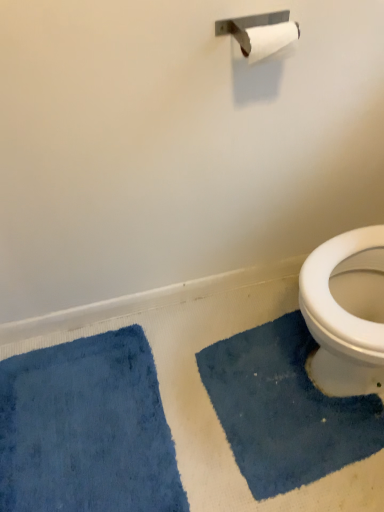
Question: Should I look upward or downward to see blue plush bath mat at lower left, placed as the 1th bath mat when sorted from left to right?

Choices:
 (A) down
 (B) up

Answer: (A)

Question: Does blue plush bath mat at lower right, arranged as the first bath mat when viewed from the right, have a lesser width compared to blue plush bath mat at lower left, placed as the 1th bath mat when sorted from left to right?

Choices:
 (A) no
 (B) yes

Answer: (B)

Question: Does blue plush bath mat at lower right, arranged as the first bath mat when viewed from the right, contain blue plush bath mat at lower left, which appears as the 2th bath mat when viewed from the right?

Choices:
 (A) yes
 (B) no

Answer: (B)

Question: Is blue plush bath mat at lower right, the second bath mat from the left, bigger than blue plush bath mat at lower left, which appears as the 2th bath mat when viewed from the right?

Choices:
 (A) no
 (B) yes

Answer: (A)

Question: Considering the relative positions of blue plush bath mat at lower right, arranged as the first bath mat when viewed from the right, and blue plush bath mat at lower left, which appears as the 2th bath mat when viewed from the right, in the image provided, is blue plush bath mat at lower right, arranged as the first bath mat when viewed from the right, to the right of blue plush bath mat at lower left, which appears as the 2th bath mat when viewed from the right, from the viewer's perspective?

Choices:
 (A) no
 (B) yes

Answer: (B)

Question: Is blue plush bath mat at lower right, arranged as the first bath mat when viewed from the right, smaller than blue plush bath mat at lower left, placed as the 1th bath mat when sorted from left to right?

Choices:
 (A) yes
 (B) no

Answer: (A)

Question: Is the depth of blue plush bath mat at lower right, the second bath mat from the left, less than that of blue plush bath mat at lower left, placed as the 1th bath mat when sorted from left to right?

Choices:
 (A) yes
 (B) no

Answer: (B)

Question: Is blue plush bath mat at lower left, which appears as the 2th bath mat when viewed from the right, not near blue plush bath mat at lower right, the second bath mat from the left?

Choices:
 (A) no
 (B) yes

Answer: (A)

Question: From the image's perspective, is blue plush bath mat at lower left, which appears as the 2th bath mat when viewed from the right, above blue plush bath mat at lower right, arranged as the first bath mat when viewed from the right?

Choices:
 (A) no
 (B) yes

Answer: (A)

Question: Is blue plush bath mat at lower left, placed as the 1th bath mat when sorted from left to right, positioned beyond the bounds of blue plush bath mat at lower right, arranged as the first bath mat when viewed from the right?

Choices:
 (A) yes
 (B) no

Answer: (A)

Question: From a real-world perspective, is blue plush bath mat at lower left, placed as the 1th bath mat when sorted from left to right, over blue plush bath mat at lower right, arranged as the first bath mat when viewed from the right?

Choices:
 (A) no
 (B) yes

Answer: (B)

Question: Does blue plush bath mat at lower left, which appears as the 2th bath mat when viewed from the right, have a lesser height compared to blue plush bath mat at lower right, arranged as the first bath mat when viewed from the right?

Choices:
 (A) yes
 (B) no

Answer: (A)

Question: Is blue plush bath mat at lower right, the second bath mat from the left, completely or partially inside blue plush bath mat at lower left, which appears as the 2th bath mat when viewed from the right?

Choices:
 (A) yes
 (B) no

Answer: (B)

Question: Considering the positions of blue plush bath mat at lower right, the second bath mat from the left, and blue plush bath mat at lower left, which appears as the 2th bath mat when viewed from the right, in the image, is blue plush bath mat at lower right, the second bath mat from the left, bigger or smaller than blue plush bath mat at lower left, which appears as the 2th bath mat when viewed from the right,?

Choices:
 (A) small
 (B) big

Answer: (A)